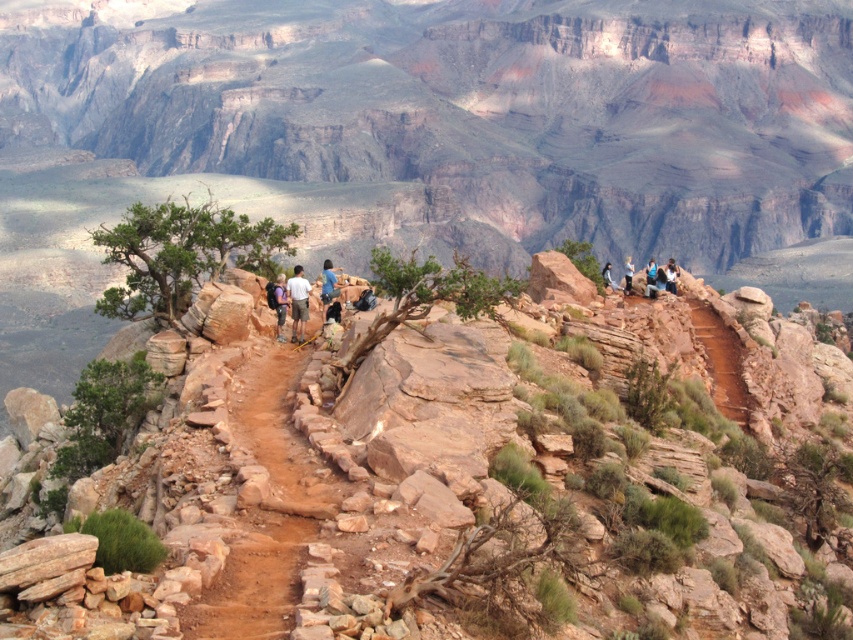
Question: Which point is farther from the camera taking this photo?

Choices:
 (A) (299, 280)
 (B) (277, 515)
 (C) (329, 273)

Answer: (C)

Question: Is brown rocky trail at center smaller than light brown leather jacket at center?

Choices:
 (A) no
 (B) yes

Answer: (A)

Question: Which of the following is the closest to the observer?

Choices:
 (A) brown rocky trail at center
 (B) blue fabric backpack at center
 (C) camouflage fabric backpack at center

Answer: (A)

Question: Is light brown leather jacket at center to the left of camouflage fabric backpack at center from the viewer's perspective?

Choices:
 (A) no
 (B) yes

Answer: (A)

Question: Is brown rocky trail at center closer to the viewer compared to blue fabric backpack at center?

Choices:
 (A) no
 (B) yes

Answer: (B)

Question: Which object appears closest to the camera in this image?

Choices:
 (A) camouflage fabric backpack at center
 (B) brown rocky trail at center
 (C) blue fabric backpack at center
 (D) light blue denim jeans at upper right

Answer: (B)